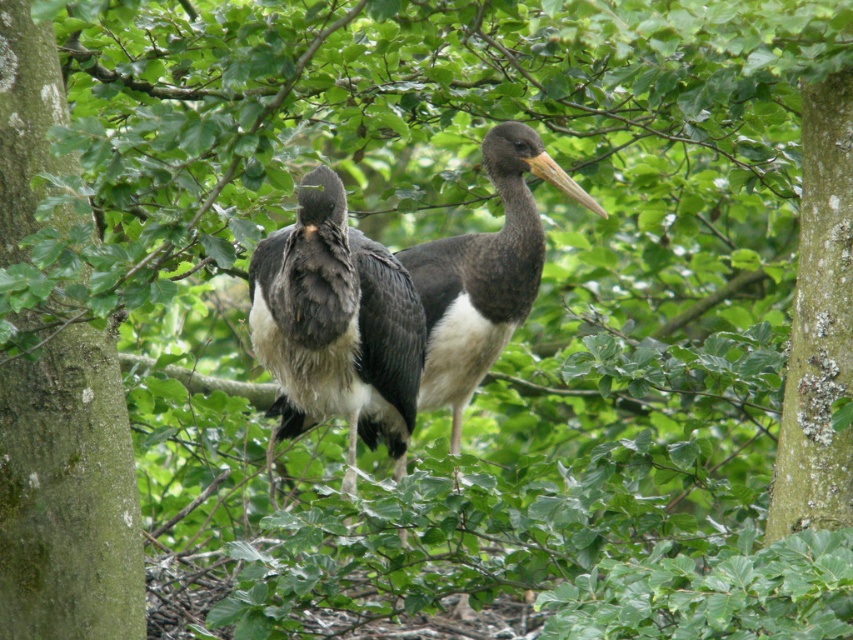
Question: Is the position of dark gray feathers at center less distant than that of black glossy stork at center?

Choices:
 (A) yes
 (B) no

Answer: (A)

Question: Can you confirm if dark gray feathers at center is wider than black glossy stork at center?

Choices:
 (A) no
 (B) yes

Answer: (A)

Question: Which object appears closest to the camera in this image?

Choices:
 (A) dark gray feathers at center
 (B) black glossy stork at center

Answer: (A)

Question: Which of the following is the farthest from the observer?

Choices:
 (A) black glossy stork at center
 (B) dark gray feathers at center

Answer: (A)

Question: Is dark gray feathers at center below black glossy stork at center?

Choices:
 (A) no
 (B) yes

Answer: (B)